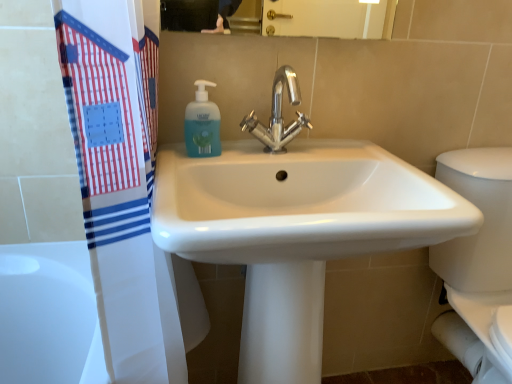
At what (x,y) coordinates should I click in order to perform the action: click on free space in front of translucent plastic soap dispenser at upper center. Please return your answer as a coordinate pair (x, y). The height and width of the screenshot is (384, 512). Looking at the image, I should click on (188, 170).